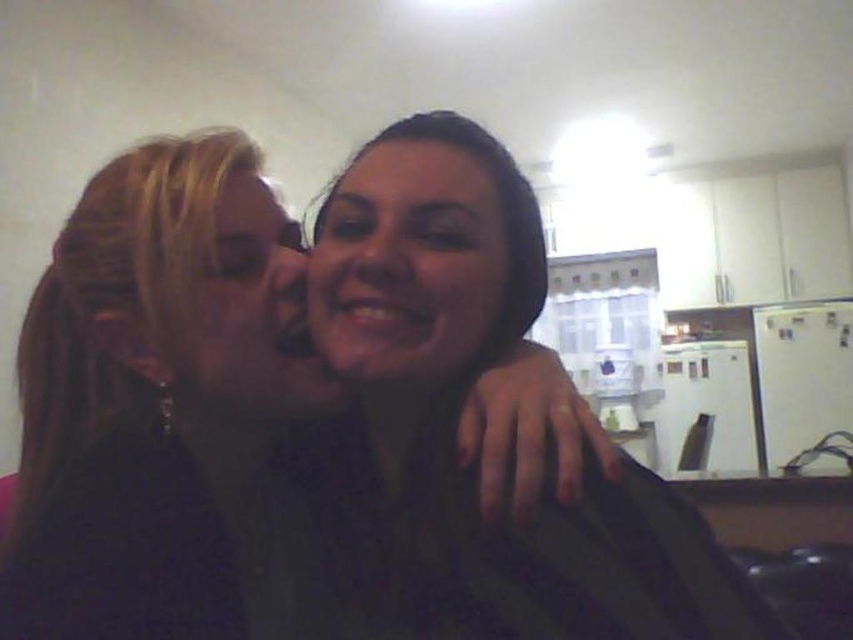
Question: Does matte black shirt at center appear on the right side of smooth skin face at center?

Choices:
 (A) no
 (B) yes

Answer: (A)

Question: Is matte black shirt at center to the right of matte black face at center from the viewer's perspective?

Choices:
 (A) yes
 (B) no

Answer: (B)

Question: Estimate the real-world distances between objects in this image. Which object is closer to the smooth skin face at center?

Choices:
 (A) matte black face at center
 (B) matte black shirt at center

Answer: (A)

Question: Among these objects, which one is nearest to the camera?

Choices:
 (A) matte black face at center
 (B) smooth skin face at center
 (C) matte black shirt at center

Answer: (C)

Question: Is matte black shirt at center in front of matte black face at center?

Choices:
 (A) yes
 (B) no

Answer: (A)

Question: Among these points, which one is farthest from the camera?

Choices:
 (A) (367, 262)
 (B) (158, 317)
 (C) (276, 333)

Answer: (C)